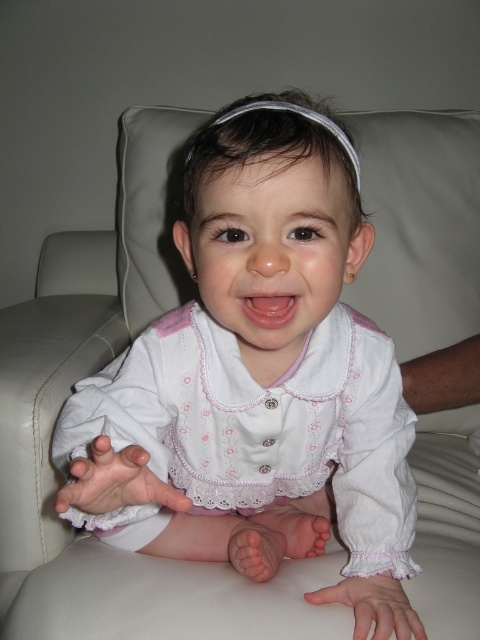
You are a photographer setting up a camera to capture the child in the scene. You notice two points marked in the image. The first point is at coordinates point (290,221) and the second is at point (133,483). Which point is closer to the camera lens?

Point (290,221) is further to the viewer than point (133,483), so the second point is closer to the camera lens.

In the image, there is a white lace baby at center and a white lace hand at lower center. Which object is positioned to the left?

The white lace baby at center is positioned to the left of the white lace hand at lower center.

You are a photographer setting up for a portrait. You need to ensure that the white lace baby at center and the white lace hand at lower left are both visible in the frame. Based on their sizes, which object should you focus on first to ensure proper framing?

The white lace baby at center is taller than the white lace hand at lower left, so you should focus on framing the white lace baby at center first to ensure it fits within the frame before adjusting for the smaller white lace hand at lower left.